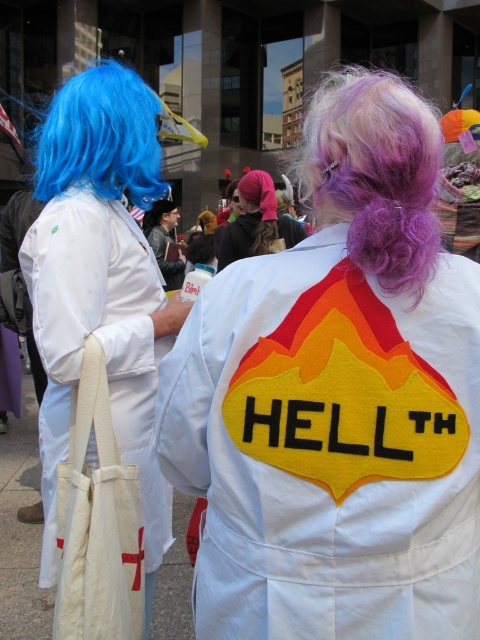
Does purple curly hair at upper center appear over dark gray fabric jacket at center?

Yes, purple curly hair at upper center is above dark gray fabric jacket at center.

Image resolution: width=480 pixels, height=640 pixels. What do you see at coordinates (374, 173) in the screenshot? I see `purple curly hair at upper center` at bounding box center [374, 173].

Locate an element on the screen. This screenshot has width=480, height=640. purple curly hair at upper center is located at coordinates (374, 173).

In the scene shown: Is blue synthetic wig at left to the right of brown straight hair at center from the viewer's perspective?

Yes, blue synthetic wig at left is to the right of brown straight hair at center.

Locate an element on the screen. blue synthetic wig at left is located at coordinates (100, 138).

I want to click on blue synthetic wig at left, so click(x=100, y=138).

The height and width of the screenshot is (640, 480). Identify the location of blue synthetic wig at left. (100, 138).

How distant is matte white coat at left from pink fabric headband at center?

matte white coat at left is 2.57 meters away from pink fabric headband at center.

Who is higher up, matte white coat at left or pink fabric headband at center?

pink fabric headband at center is higher up.

The width and height of the screenshot is (480, 640). Identify the location of matte white coat at left. (100, 284).